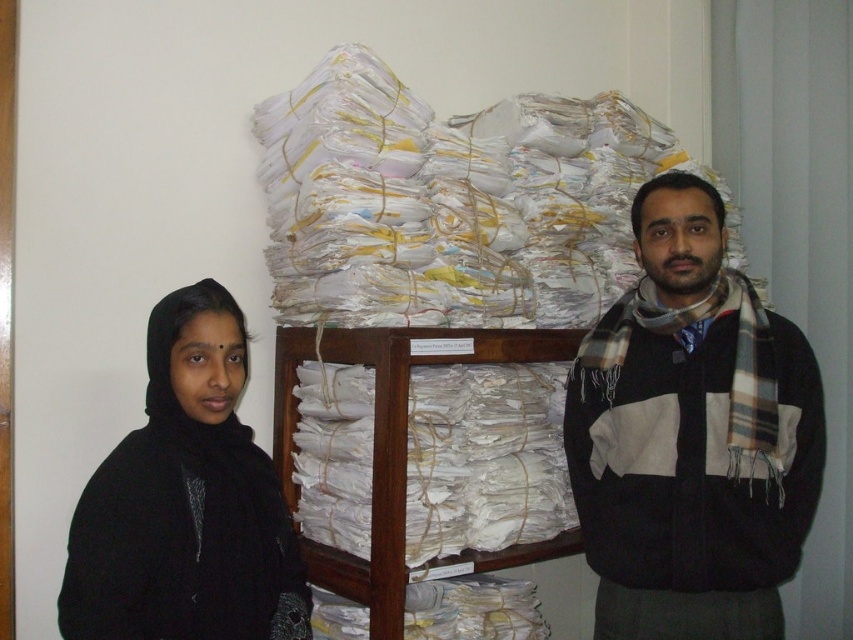
You are an office assistant who needs to file a document. You see the white paper at center and the plaid scarf at right. Which item is shorter?

The white paper at center is shorter than the plaid scarf at right.

You are a photographer standing in front of the scene. You need to determine which of the two points, point (x=654, y=198) or point (x=123, y=476), is closer to you. Based on the spatial arrangement, which point is nearer?

Point (x=654, y=198) is further to the viewer than point (x=123, y=476), so the point closer to you is point (x=123, y=476).